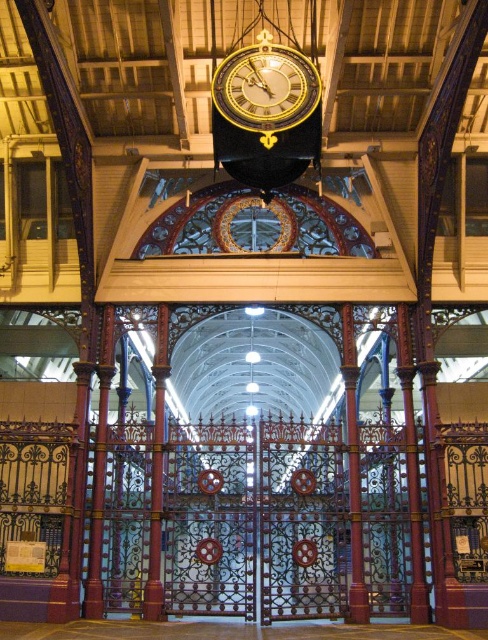
Question: Is metallic wrought iron gate at lower center smaller than gold metallic clock at center?

Choices:
 (A) yes
 (B) no

Answer: (B)

Question: Which object appears closest to the camera in this image?

Choices:
 (A) gold metallic clock at center
 (B) metallic wrought iron gate at lower center

Answer: (A)

Question: Is metallic wrought iron gate at lower center wider than gold metallic clock at center?

Choices:
 (A) no
 (B) yes

Answer: (B)

Question: Can you confirm if metallic wrought iron gate at lower center is smaller than gold metallic clock at center?

Choices:
 (A) no
 (B) yes

Answer: (A)

Question: Which point is closer to the camera?

Choices:
 (A) (246, 81)
 (B) (204, 497)

Answer: (A)